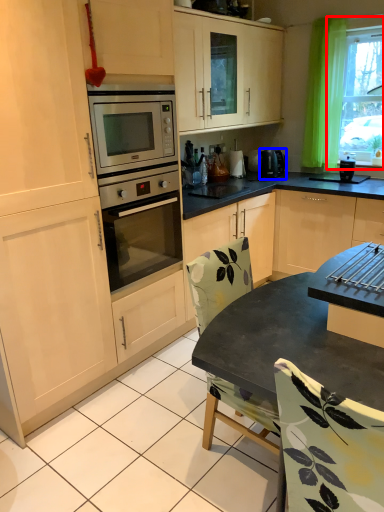
Question: Which object is further to the camera taking this photo, window (highlighted by a red box) or kitchen appliance (highlighted by a blue box)?

Choices:
 (A) window
 (B) kitchen appliance

Answer: (B)